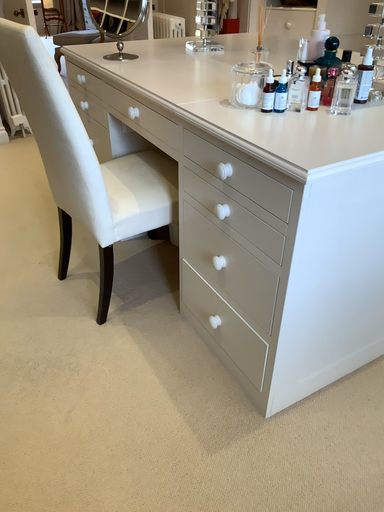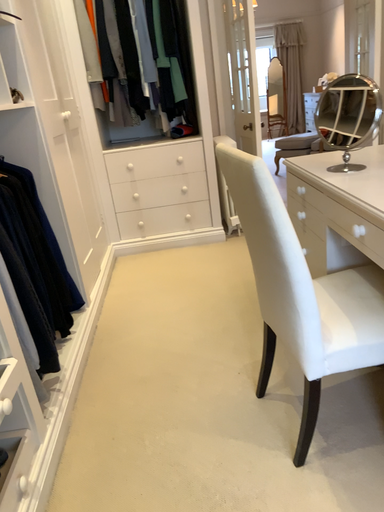
Question: Which way did the camera rotate in the video?

Choices:
 (A) rotated upward
 (B) rotated downward

Answer: (A)